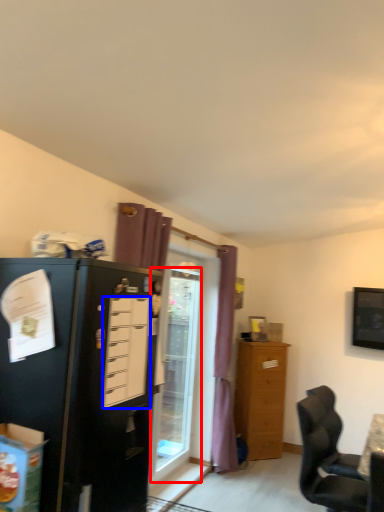
Question: Which point is closer to the camera, glass door (highlighted by a red box) or drawer (highlighted by a blue box)?

Choices:
 (A) glass door
 (B) drawer

Answer: (B)